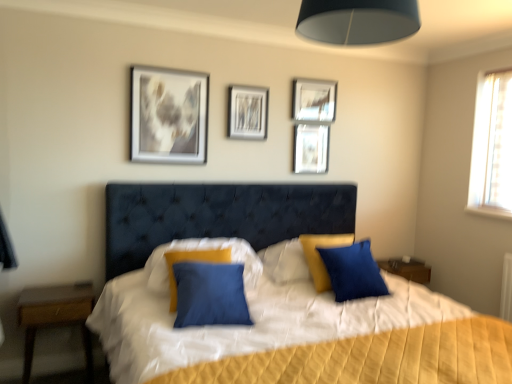
Question: Considering the relative sizes of metallic silver picture frame at upper center, which is the 1th picture frame in right-to-left order, and metallic silver picture frame at upper center, the 2th picture frame from the left, in the image provided, is metallic silver picture frame at upper center, which is the 1th picture frame in right-to-left order, taller than metallic silver picture frame at upper center, the 2th picture frame from the left,?

Choices:
 (A) no
 (B) yes

Answer: (A)

Question: Can you confirm if metallic silver picture frame at upper center, which is the 1th picture frame in right-to-left order, is bigger than metallic silver picture frame at upper center, the 2th picture frame from the left?

Choices:
 (A) yes
 (B) no

Answer: (A)

Question: Is metallic silver picture frame at upper center, the 2th picture frame from the left, a part of metallic silver picture frame at upper center, which is the 1th picture frame in right-to-left order?

Choices:
 (A) yes
 (B) no

Answer: (B)

Question: From a real-world perspective, is metallic silver picture frame at upper center, the 4th picture frame positioned from the left, physically above metallic silver picture frame at upper center, the 2th picture frame from the left?

Choices:
 (A) no
 (B) yes

Answer: (B)

Question: Can you confirm if metallic silver picture frame at upper center, which is the 1th picture frame in right-to-left order, is smaller than metallic silver picture frame at upper center, positioned as the 3th picture frame in right-to-left order?

Choices:
 (A) yes
 (B) no

Answer: (B)

Question: Does metallic silver picture frame at upper center, the 4th picture frame positioned from the left, turn towards metallic silver picture frame at upper center, positioned as the 3th picture frame in right-to-left order?

Choices:
 (A) no
 (B) yes

Answer: (A)

Question: From the image's perspective, is metallic silver picture frame at upper center, the first picture frame positioned from the left, beneath black fabric lampshade at upper center?

Choices:
 (A) yes
 (B) no

Answer: (A)

Question: Considering the relative sizes of metallic silver picture frame at upper center, the first picture frame positioned from the left, and black fabric lampshade at upper center in the image provided, is metallic silver picture frame at upper center, the first picture frame positioned from the left, wider than black fabric lampshade at upper center?

Choices:
 (A) yes
 (B) no

Answer: (B)

Question: Can you confirm if metallic silver picture frame at upper center, the first picture frame positioned from the left, is thinner than black fabric lampshade at upper center?

Choices:
 (A) yes
 (B) no

Answer: (A)

Question: Does metallic silver picture frame at upper center, the 4th picture frame from the right, have a smaller size compared to black fabric lampshade at upper center?

Choices:
 (A) yes
 (B) no

Answer: (A)

Question: Is metallic silver picture frame at upper center, the first picture frame positioned from the left, closer to the viewer compared to black fabric lampshade at upper center?

Choices:
 (A) no
 (B) yes

Answer: (A)

Question: Would you say metallic silver picture frame at upper center, the first picture frame positioned from the left, is outside black fabric lampshade at upper center?

Choices:
 (A) no
 (B) yes

Answer: (B)

Question: Can you confirm if wooden nightstand at left is bigger than metallic silver picture frame at upper center, the 4th picture frame positioned from the left?

Choices:
 (A) yes
 (B) no

Answer: (A)